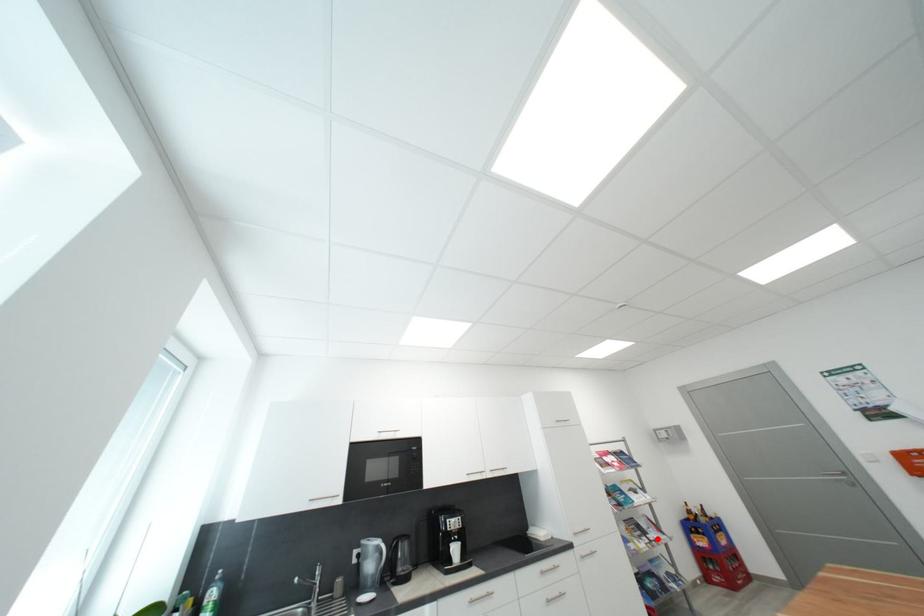
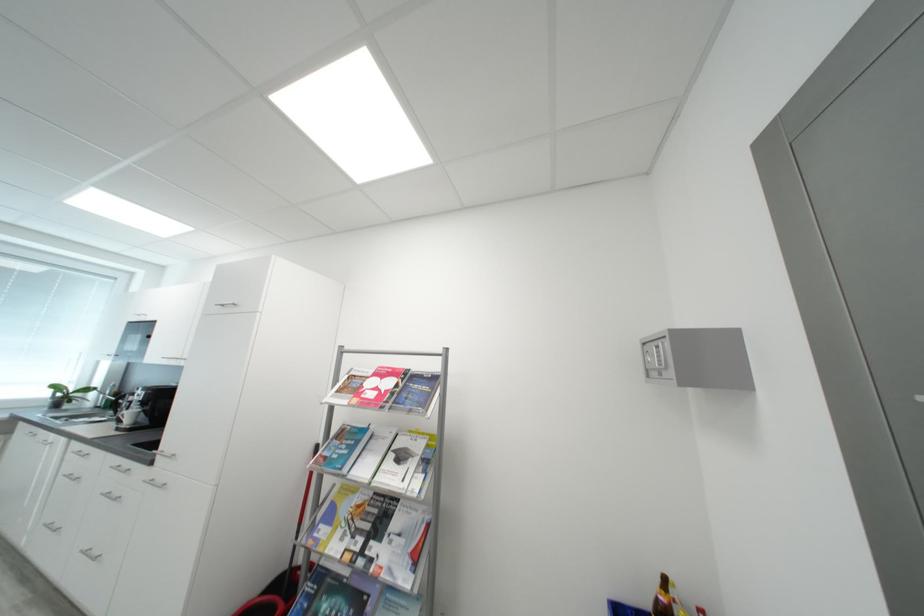
Where in the second image is the point corresponding to the highlighted location from the first image?

(380, 549)